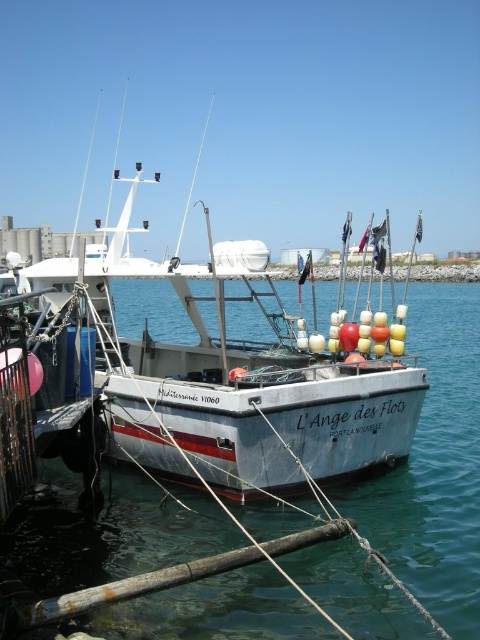
Question: Does clear blue water at center appear on the right side of white matte fishing boat at center?

Choices:
 (A) no
 (B) yes

Answer: (A)

Question: Which object appears farthest from the camera in this image?

Choices:
 (A) clear blue water at center
 (B) white matte fishing boat at center

Answer: (B)

Question: Can you confirm if clear blue water at center is smaller than white matte fishing boat at center?

Choices:
 (A) yes
 (B) no

Answer: (A)

Question: Is clear blue water at center closer to camera compared to white matte fishing boat at center?

Choices:
 (A) yes
 (B) no

Answer: (A)

Question: Among these objects, which one is farthest from the camera?

Choices:
 (A) white matte fishing boat at center
 (B) clear blue water at center

Answer: (A)